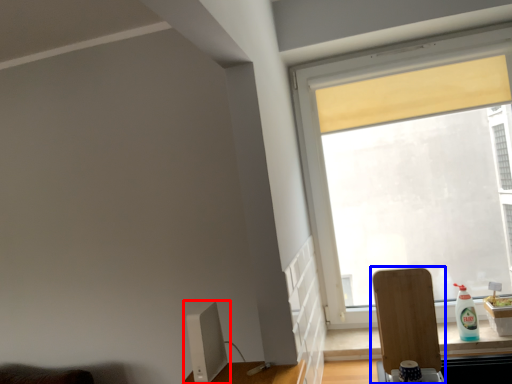
Question: Which of the following is the farthest to the observer, computer monitor (highlighted by a red box) or swivel chair (highlighted by a blue box)?

Choices:
 (A) computer monitor
 (B) swivel chair

Answer: (B)